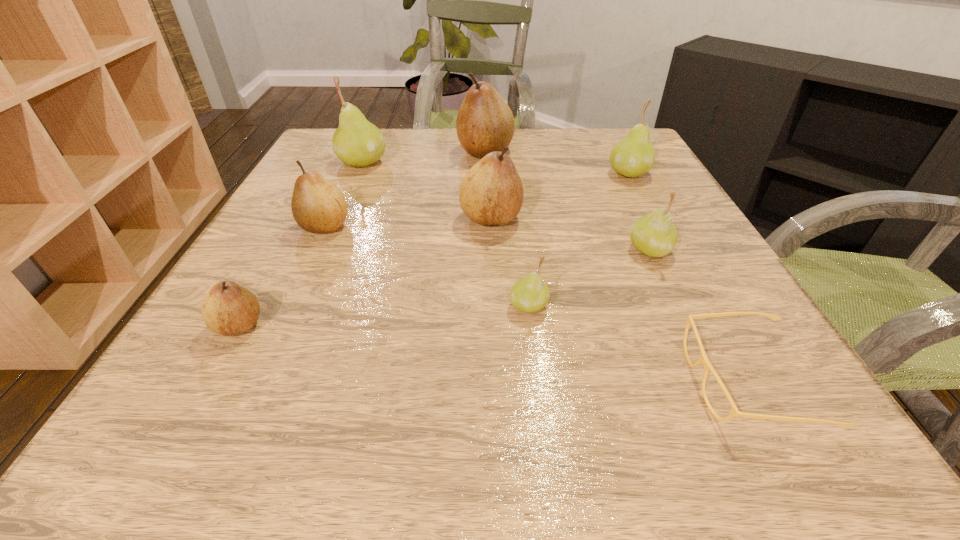
Where is `the biggest brown pear`? The width and height of the screenshot is (960, 540). the biggest brown pear is located at coordinates (485, 123).

The image size is (960, 540). I want to click on the leftmost green pear, so click(x=357, y=142).

I want to click on the third smallest green pear, so click(633, 156).

Image resolution: width=960 pixels, height=540 pixels. I want to click on the third smallest brown pear, so click(x=491, y=192).

The height and width of the screenshot is (540, 960). In order to click on the third biggest brown pear in this screenshot , I will do `click(318, 206)`.

This screenshot has height=540, width=960. I want to click on the second nearest green pear, so click(654, 234).

Identify the location of the smallest green pear. This screenshot has width=960, height=540. (530, 294).

Find the location of `the second green pear from left to right`. the second green pear from left to right is located at coordinates (530, 294).

Locate an element on the screen. The height and width of the screenshot is (540, 960). the nearest brown pear is located at coordinates (228, 309).

What are the coordinates of `the shortest object` in the screenshot? It's located at (703, 358).